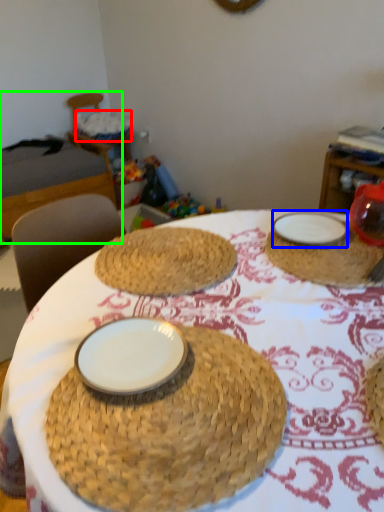
Question: Which object is positioned closest to basket (highlighted by a red box)? Select from plate (highlighted by a blue box) and bed (highlighted by a green box).

Choices:
 (A) plate
 (B) bed

Answer: (B)